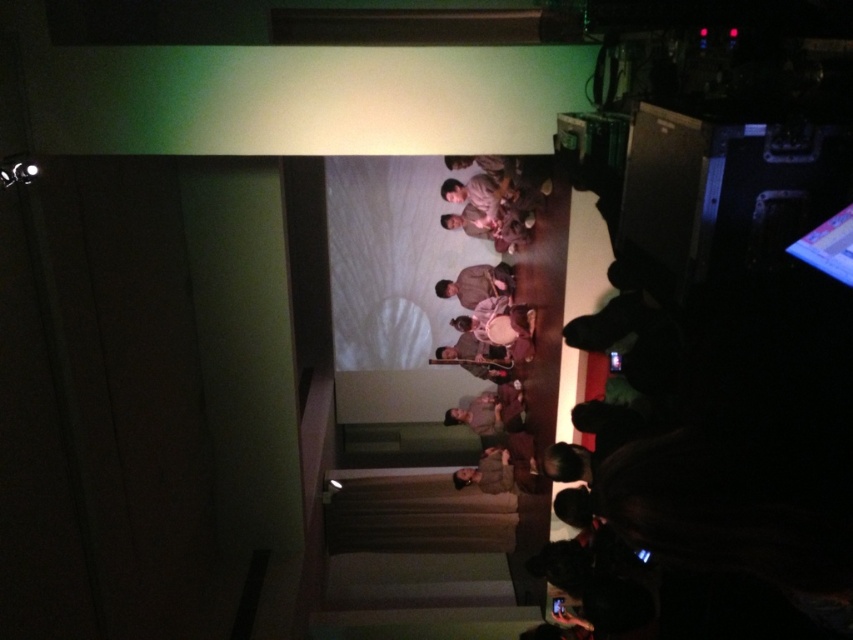
Is point (450, 417) behind point (463, 276)?

Yes, point (450, 417) is farther from viewer.

Is point (506, 408) less distant than point (457, 291)?

Yes, point (506, 408) is in front of point (457, 291).

Locate an element on the screen. This screenshot has height=640, width=853. brown fabric at center is located at coordinates (491, 410).